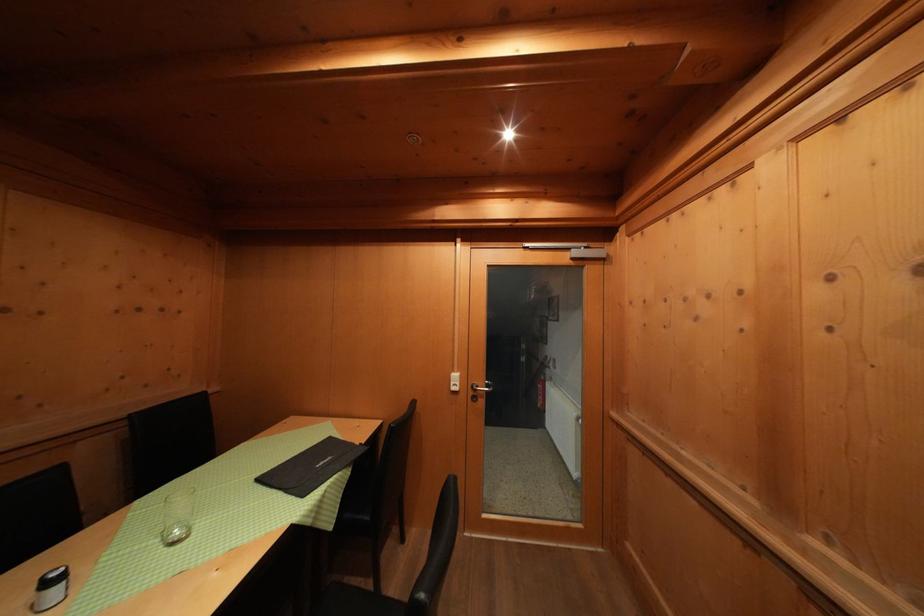
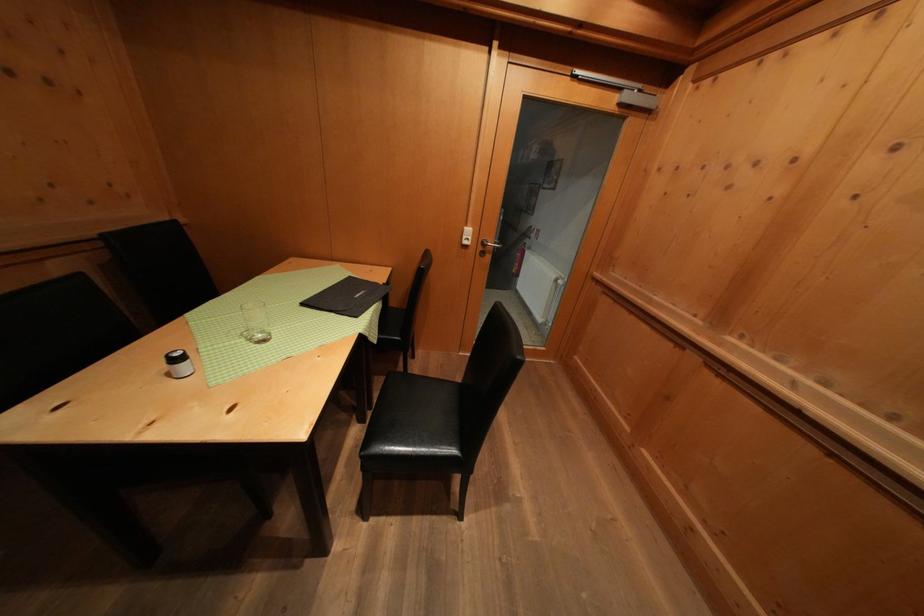
Where in the second image is the point corresponding to (x=335, y=443) from the first image?

(357, 283)